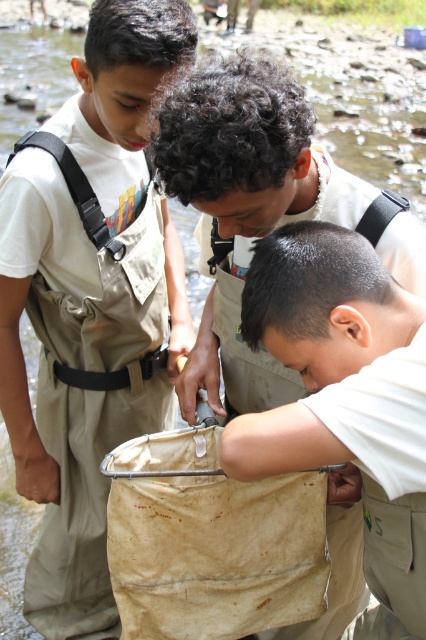
Is point (91, 548) closer to viewer compared to point (287, 170)?

No.

Is matte khaki waders at left positioned behind tan fabric bag at center?

Yes, matte khaki waders at left is further from the viewer.

The height and width of the screenshot is (640, 426). Identify the location of matte khaki waders at left. (92, 304).

Is matte khaki waders at left thinner than white matte cloth at lower center?

No.

Between point (166, 326) and point (316, 321), which one is positioned in front?

Point (316, 321) is more forward.

Locate an element on the screen. matte khaki waders at left is located at coordinates (92, 304).

Which is more to the left, white matte cloth at lower center or tan fabric bag at center?

tan fabric bag at center

Does white matte cloth at lower center appear under tan fabric bag at center?

Yes.

Describe the element at coordinates (339, 385) in the screenshot. Image resolution: width=426 pixels, height=640 pixels. I see `white matte cloth at lower center` at that location.

Where is `white matte cloth at lower center`? The height and width of the screenshot is (640, 426). white matte cloth at lower center is located at coordinates (339, 385).